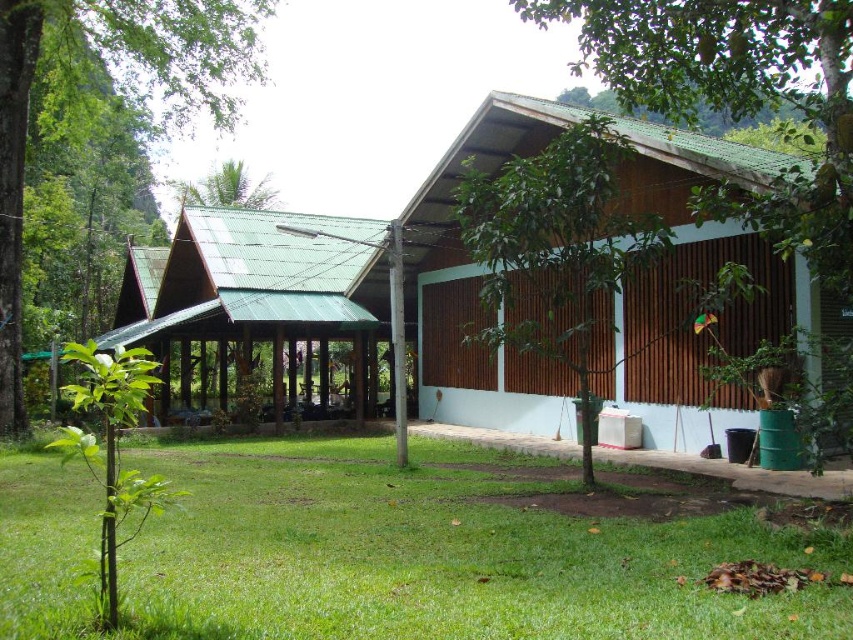
You are planning to place a picnic blanket on the green grass at lower center and the green leafy palm tree at upper left. Which area has enough space to accommodate the blanket?

The green grass at lower center has a larger width than the green leafy palm tree at upper left, so it can accommodate the picnic blanket more comfortably.

You are standing at the entrance of the wooden structure with a green roof and want to walk towards the green leafy palm tree at upper left. Which direction should you walk to avoid the green grass at lower center?

To avoid the green grass at lower center, you should walk towards the upper left direction, away from the green grass at lower center, since it is positioned under the green leafy palm tree at upper left.